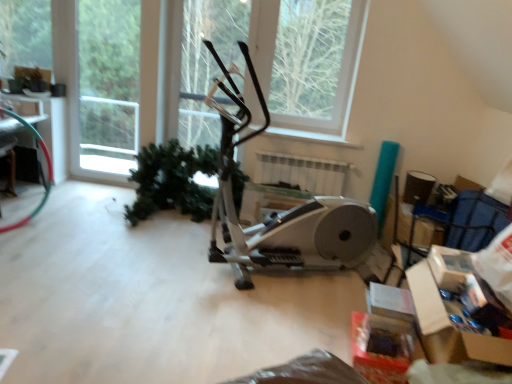
Question: From a real-world perspective, is green matte tree at upper left, placed as the 1th tree when sorted from left to right, located beneath cardboard box at lower right?

Choices:
 (A) no
 (B) yes

Answer: (A)

Question: Does green matte tree at upper left, positioned as the second tree in right-to-left order, come in front of cardboard box at lower right?

Choices:
 (A) yes
 (B) no

Answer: (B)

Question: Considering the relative sizes of green matte tree at upper left, placed as the 1th tree when sorted from left to right, and cardboard box at lower right in the image provided, is green matte tree at upper left, placed as the 1th tree when sorted from left to right, smaller than cardboard box at lower right?

Choices:
 (A) no
 (B) yes

Answer: (B)

Question: Is green matte tree at upper left, placed as the 1th tree when sorted from left to right, taller than cardboard box at lower right?

Choices:
 (A) no
 (B) yes

Answer: (B)

Question: Is green matte tree at upper left, placed as the 1th tree when sorted from left to right, positioned far away from cardboard box at lower right?

Choices:
 (A) no
 (B) yes

Answer: (B)

Question: Can you confirm if green matte tree at upper left, positioned as the second tree in right-to-left order, is wider than cardboard box at lower right?

Choices:
 (A) no
 (B) yes

Answer: (A)

Question: Can you confirm if white plastic window frame at upper left is wider than green matte plant at center?

Choices:
 (A) no
 (B) yes

Answer: (A)

Question: Is white plastic window frame at upper left closer to the viewer compared to green matte plant at center?

Choices:
 (A) yes
 (B) no

Answer: (B)

Question: Can you confirm if white plastic window frame at upper left is shorter than green matte plant at center?

Choices:
 (A) yes
 (B) no

Answer: (B)

Question: From the image's perspective, is white plastic window frame at upper left below green matte plant at center?

Choices:
 (A) no
 (B) yes

Answer: (A)

Question: Is green matte plant at center located within white plastic window frame at upper left?

Choices:
 (A) no
 (B) yes

Answer: (A)

Question: Does white plastic window frame at upper left appear on the right side of green matte plant at center?

Choices:
 (A) no
 (B) yes

Answer: (A)

Question: From a real-world perspective, is silver metallic stationary bicycle at center below green matte tree at upper left, placed as the 1th tree when sorted from left to right?

Choices:
 (A) no
 (B) yes

Answer: (B)